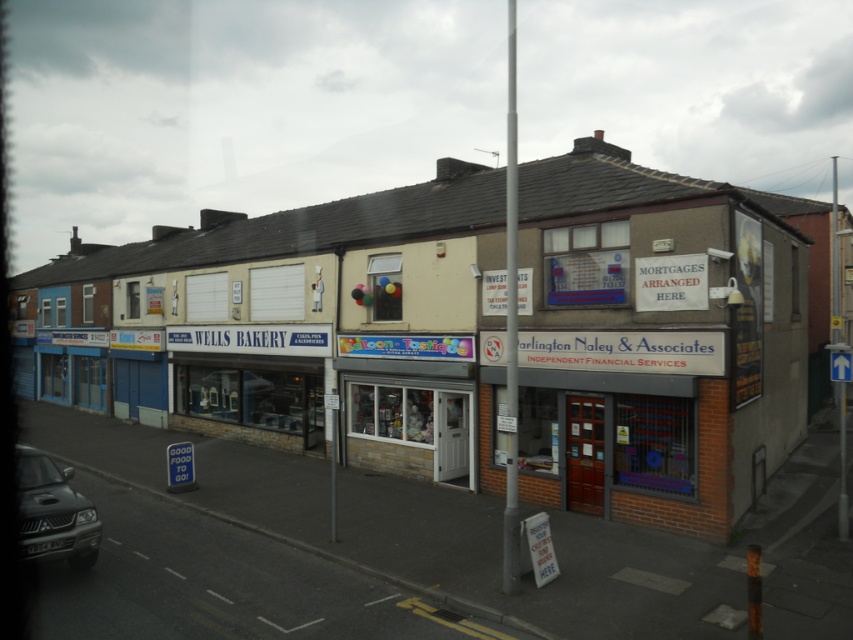
Question: Which point appears farthest from the camera in this image?

Choices:
 (A) (73, 506)
 (B) (512, 525)

Answer: (A)

Question: Which of the following is the closest to the observer?

Choices:
 (A) (68, 509)
 (B) (505, 584)

Answer: (B)

Question: Does matte black car at lower left have a larger size compared to metallic pole at center?

Choices:
 (A) yes
 (B) no

Answer: (B)

Question: In this image, where is matte black car at lower left located relative to metallic pole at center?

Choices:
 (A) right
 (B) left

Answer: (B)

Question: Which object is farther from the camera taking this photo?

Choices:
 (A) metallic pole at center
 (B) matte black car at lower left

Answer: (A)

Question: Does matte black car at lower left appear over metallic pole at center?

Choices:
 (A) yes
 (B) no

Answer: (B)